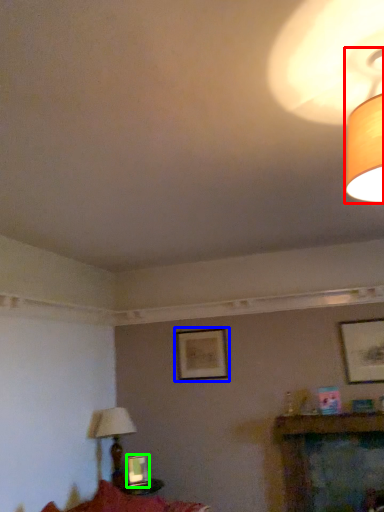
Question: Which is farther away from lamp (highlighted by a red box)? picture frame (highlighted by a blue box) or picture frame (highlighted by a green box)?

Choices:
 (A) picture frame
 (B) picture frame

Answer: (B)